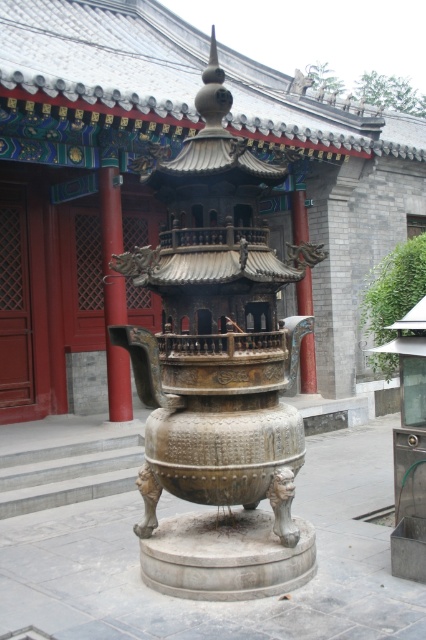
Is smooth red pillar at center wider than bronze textured pillar at center?

Indeed, smooth red pillar at center has a greater width compared to bronze textured pillar at center.

Where is `smooth red pillar at center`? The image size is (426, 640). smooth red pillar at center is located at coordinates (114, 291).

Describe the element at coordinates (114, 291) in the screenshot. I see `smooth red pillar at center` at that location.

You are a GUI agent. You are given a task and a screenshot of the screen. Output one action in this format:
    pyautogui.click(x=<x>, y=<y>)
    Task: Click on the smooth red pillar at center
    
    Given the screenshot: What is the action you would take?
    pyautogui.click(x=114, y=291)